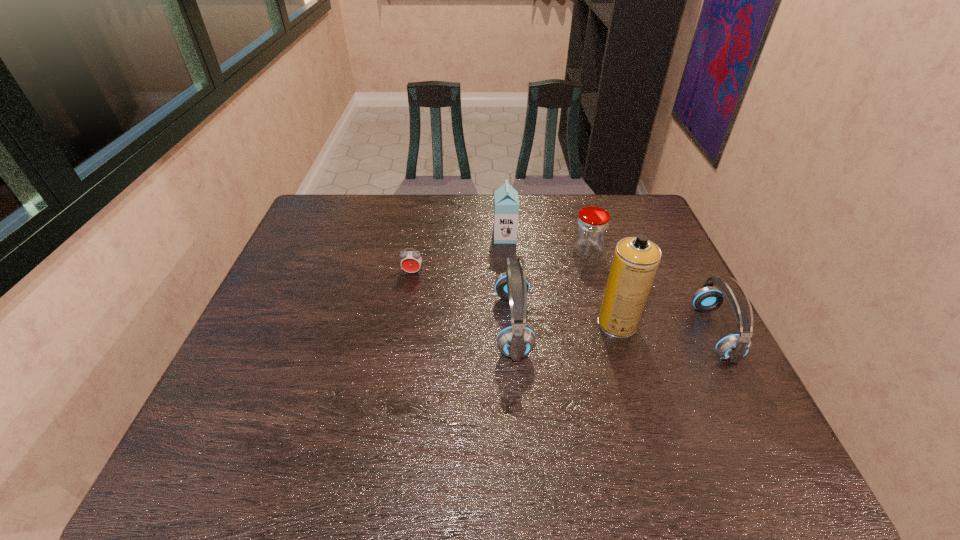
You are a GUI agent. You are given a task and a screenshot of the screen. Output one action in this format:
    pyautogui.click(x=<x>, y=<y>)
    Task: Click on the left headset
    
    Given the screenshot: What is the action you would take?
    [x=516, y=340]

In order to click on the rightmost object in this screenshot , I will do point(732,347).

Locate an element on the screen. the right headset is located at coordinates (732, 347).

Locate an element on the screen. The height and width of the screenshot is (540, 960). jar is located at coordinates coord(591,229).

At what (x,y) coordinates should I click in order to perform the action: click on alarm clock. Please return your answer as a coordinate pair (x, y). Looking at the image, I should click on (411, 261).

Locate an element on the screen. Image resolution: width=960 pixels, height=540 pixels. the third farthest object is located at coordinates (411, 261).

At what (x,y) coordinates should I click in order to perform the action: click on milk carton. Please return your answer as a coordinate pair (x, y). Image resolution: width=960 pixels, height=540 pixels. Looking at the image, I should click on (506, 202).

I want to click on aerosol can, so click(x=635, y=262).

Locate an element on the screen. Image resolution: width=960 pixels, height=540 pixels. free location located 0.340m on the ear cups of the taller headset is located at coordinates (663, 325).

You are a GUI agent. You are given a task and a screenshot of the screen. Output one action in this format:
    pyautogui.click(x=<x>, y=<y>)
    Task: Click on the vacant space located 0.230m on the back of the jar
    Image resolution: width=960 pixels, height=540 pixels.
    Given the screenshot: What is the action you would take?
    pyautogui.click(x=573, y=202)